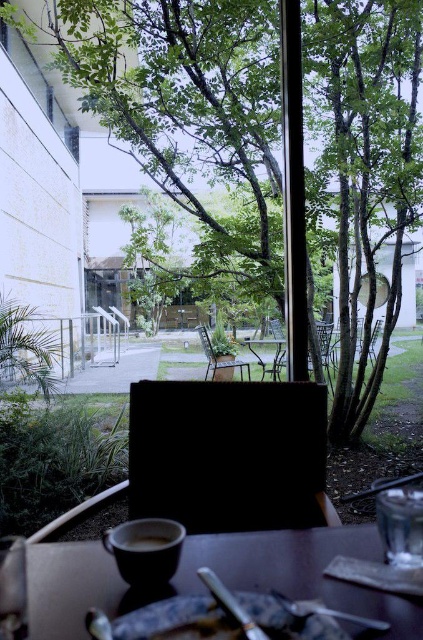
Question: Is matte ceramic plate at lower center positioned at the back of metallic silver fork at lower center?

Choices:
 (A) yes
 (B) no

Answer: (B)

Question: Which point is farther to the camera?

Choices:
 (A) matte ceramic cup at lower left
 (B) matte ceramic cup at lower center

Answer: (B)

Question: Does green leafy tree at center have a lesser width compared to metallic silver fork at lower center?

Choices:
 (A) no
 (B) yes

Answer: (A)

Question: Can you confirm if green leafy tree at center is positioned to the left of matte ceramic cup at lower left?

Choices:
 (A) yes
 (B) no

Answer: (B)

Question: Which point is closer to the camera taking this photo?

Choices:
 (A) (357, 625)
 (B) (159, 545)

Answer: (A)

Question: Among these points, which one is farthest from the camera?

Choices:
 (A) (299, 612)
 (B) (414, 612)

Answer: (B)